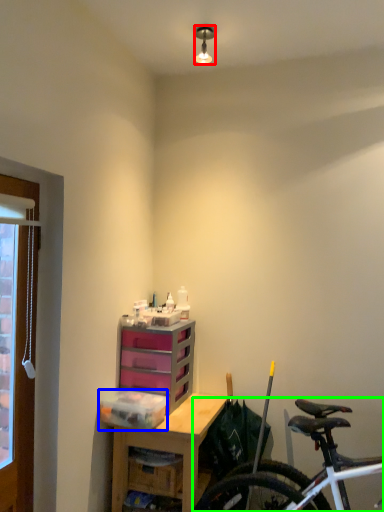
Question: Which object is positioned closest to lamp (highlighted by a red box)? Select from storage box (highlighted by a blue box) and bicycle (highlighted by a green box).

Choices:
 (A) storage box
 (B) bicycle

Answer: (A)